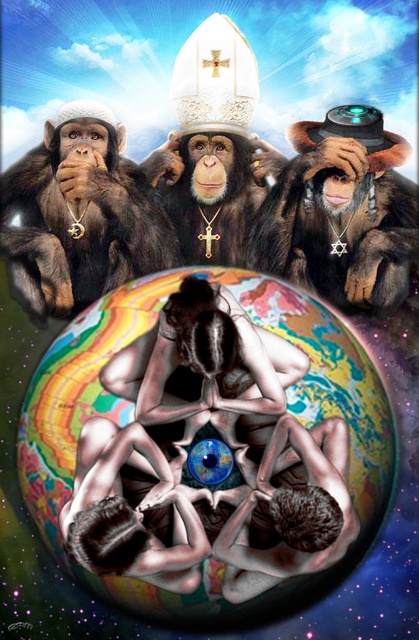
Question: Does smooth skin figure at center have a lesser width compared to shiny gold cross at center?

Choices:
 (A) yes
 (B) no

Answer: (A)

Question: Is metallic silver person at center to the right of smooth skin figure at lower center from the viewer's perspective?

Choices:
 (A) no
 (B) yes

Answer: (A)

Question: Which point is closer to the camera taking this photo?

Choices:
 (A) (264, 568)
 (B) (116, 564)
 (C) (154, 500)
 (D) (202, 204)

Answer: (B)

Question: Which point is closer to the camera?

Choices:
 (A) metallic silver person at center
 (B) smooth skin figure at lower center
 (C) shiny black hat at center
 (D) shiny brown fur monkey at left

Answer: (A)

Question: Is smooth skin figure at center positioned in front of shiny gold cross at center?

Choices:
 (A) yes
 (B) no

Answer: (A)

Question: Based on their relative distances, which object is farther from the shiny brown fur monkey at left?

Choices:
 (A) smooth skin figure at lower center
 (B) shiny gold cross at center

Answer: (A)